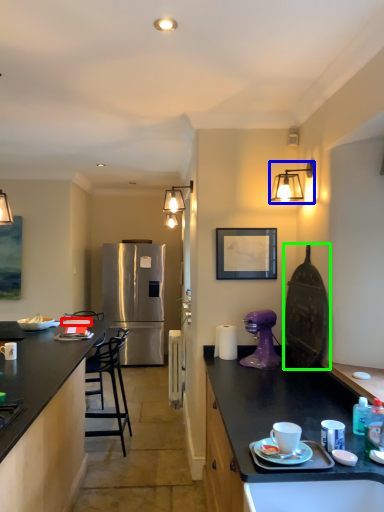
Question: Based on their relative distances, which object is farther from tableware (highlighted by a red box)? Choose from lamp (highlighted by a blue box) and appliance (highlighted by a green box).

Choices:
 (A) lamp
 (B) appliance

Answer: (A)